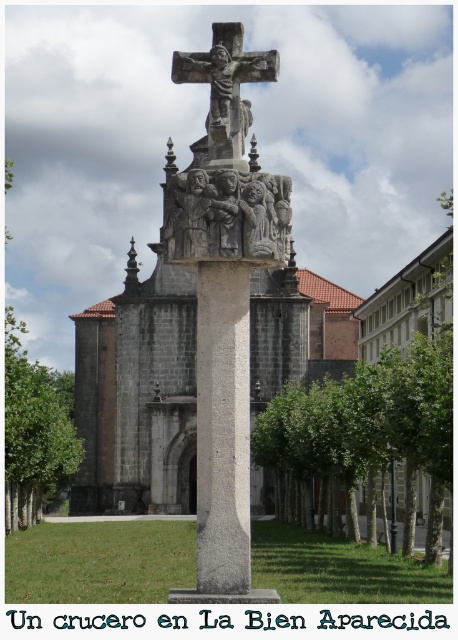
From the picture: Between carved stone relief at center and matte stone statue at center, which one has less height?

Standing shorter between the two is matte stone statue at center.

Is carved stone relief at center behind matte stone statue at center?

No, it is not.

Image resolution: width=458 pixels, height=640 pixels. Describe the element at coordinates (190, 216) in the screenshot. I see `carved stone relief at center` at that location.

Identify the location of carved stone relief at center. (190, 216).

Can you confirm if matte stone statue at center is positioned to the left of matte stone carving at center?

Correct, you'll find matte stone statue at center to the left of matte stone carving at center.

Is point (212, 221) closer to camera compared to point (247, 257)?

That is False.

Between point (222, 248) and point (252, 202), which one is positioned in front?

Point (222, 248)

Identify the location of matte stone statue at center. Image resolution: width=458 pixels, height=640 pixels. (223, 214).

Is point (212, 224) positioned behind point (213, 45)?

No, (212, 224) is closer to viewer.

This screenshot has height=640, width=458. In order to click on matte stone statue at center in this screenshot , I will do `click(223, 214)`.